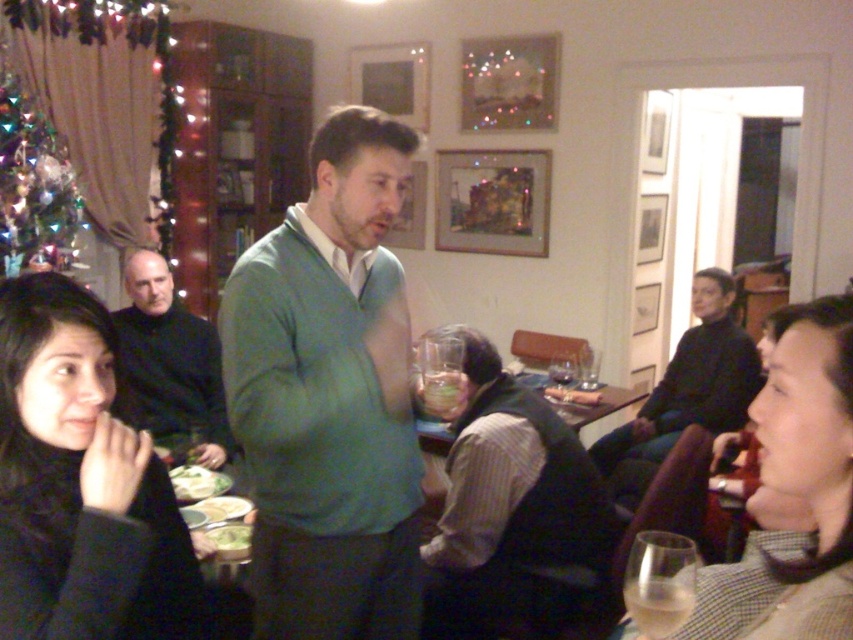
You are standing in the room and want to hand a drink to both the green sweater at center and the striped fabric shirt at center. Which one should you approach first based on their positions?

You should approach the green sweater at center first because it is closer to you than the striped fabric shirt at center.

You are planning to place a new decorative item in the scene. The dark gray sweater at right and the green leafy vegetable at lower left are both present. Which object has a greater width, and thus might require more space for placement?

The dark gray sweater at right has a greater width than the green leafy vegetable at lower left, so it requires more space for placement.